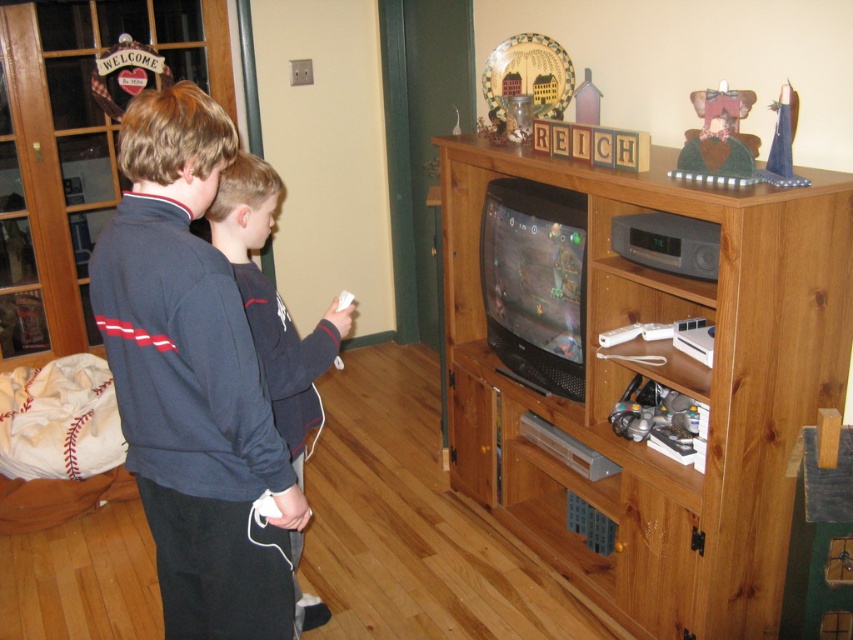
Between dark blue sweatshirt at left and white matte remote at center, which one appears on the left side from the viewer's perspective?

dark blue sweatshirt at left is more to the left.

Can you confirm if dark blue sweatshirt at left is smaller than white matte remote at center?

Actually, dark blue sweatshirt at left might be larger than white matte remote at center.

Where is `dark blue sweatshirt at left`? The height and width of the screenshot is (640, 853). dark blue sweatshirt at left is located at coordinates (192, 380).

Find the location of a particular element. The width and height of the screenshot is (853, 640). dark blue sweatshirt at left is located at coordinates [x=192, y=380].

Is brown wood entertainment center at center behind dark blue sweatshirt at center?

Yes, brown wood entertainment center at center is behind dark blue sweatshirt at center.

In the scene shown: Is brown wood entertainment center at center taller than dark blue sweatshirt at center?

Yes.

Does point (782, 323) come farther from viewer compared to point (292, 449)?

No.

Where is `brown wood entertainment center at center`? This screenshot has height=640, width=853. brown wood entertainment center at center is located at coordinates click(x=660, y=381).

Does dark blue sweatshirt at center appear over white matte remote at center?

No, dark blue sweatshirt at center is not above white matte remote at center.

Can you confirm if dark blue sweatshirt at center is smaller than white matte remote at center?

Actually, dark blue sweatshirt at center might be larger than white matte remote at center.

Between point (291, 378) and point (341, 296), which one is positioned in front?

Point (291, 378) is more forward.

What are the coordinates of `dark blue sweatshirt at center` in the screenshot? It's located at (273, 301).